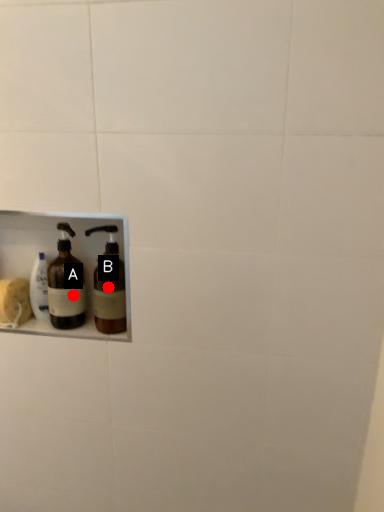
Question: Two points are circled on the image, labeled by A and B beside each circle. Which point is closer to the camera taking this photo?

Choices:
 (A) A is closer
 (B) B is closer

Answer: (A)